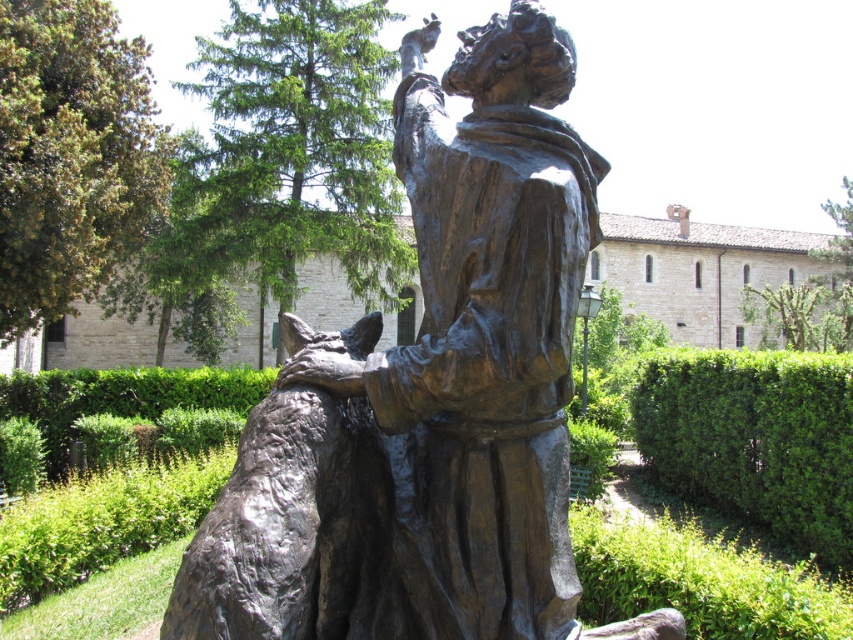
You are standing in the garden looking at the bronze statue. There are two points marked on the statue. The first point is at coordinate (564, 342) and the second is at (763, 417). Which point is closer to you?

Point (564, 342) is in front of point (763, 417), so the first point is closer to you.

You are a gardener who needs to water the green leafy hedge at right. The bronze statue at center is in your way. Can you move around the statue to access the hedge?

The bronze statue at center is located above green leafy hedge at right, so you can move around the statue to access the hedge since it is elevated and not blocking the path.

You are a tour guide standing 1.82 meters away from the bronze statue at center. You need to place a protective barrier around it that must be at least 2 meters away from the statue. Is the current distance sufficient?

The bronze statue at center is 1.82 meters away from the viewer. Since the required distance for the protective barrier is at least 2 meters, the current distance is insufficient. The barrier needs to be placed further away to meet the requirement.